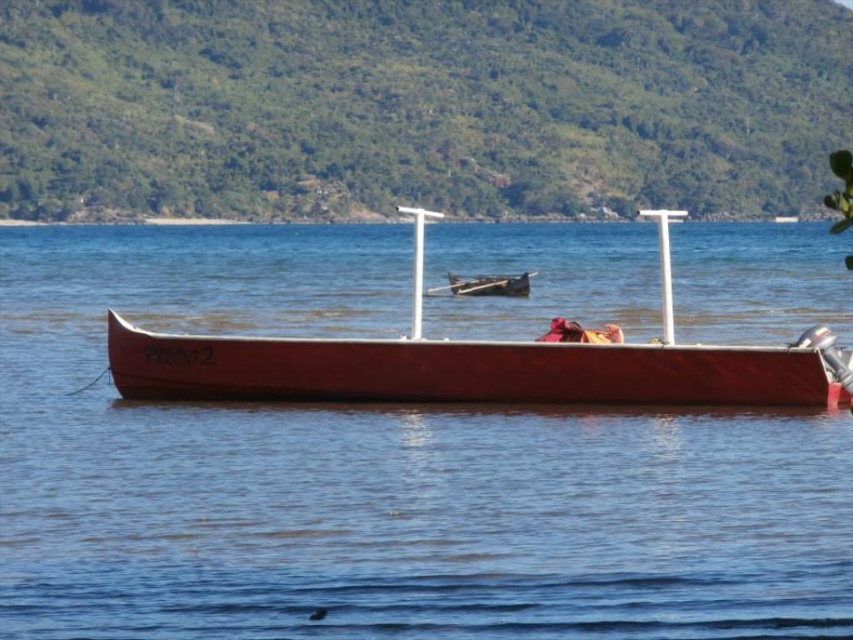
Based on the photo, you are an adventurer planning to cross the smooth water at center in the smooth wood canoe at center. Based on the scene description, will the canoe fit comfortably on the water without touching the bottom?

The smooth water at center has a larger width than the smooth wood canoe at center, so the canoe should fit comfortably on the water without any issues.

You are an observer standing on the shore looking at the scene. There is smooth water at center and a smooth red boat at center. Which object is closer to you?

The smooth water at center is positioned over the smooth red boat at center, so the smooth water at center is closer to you.